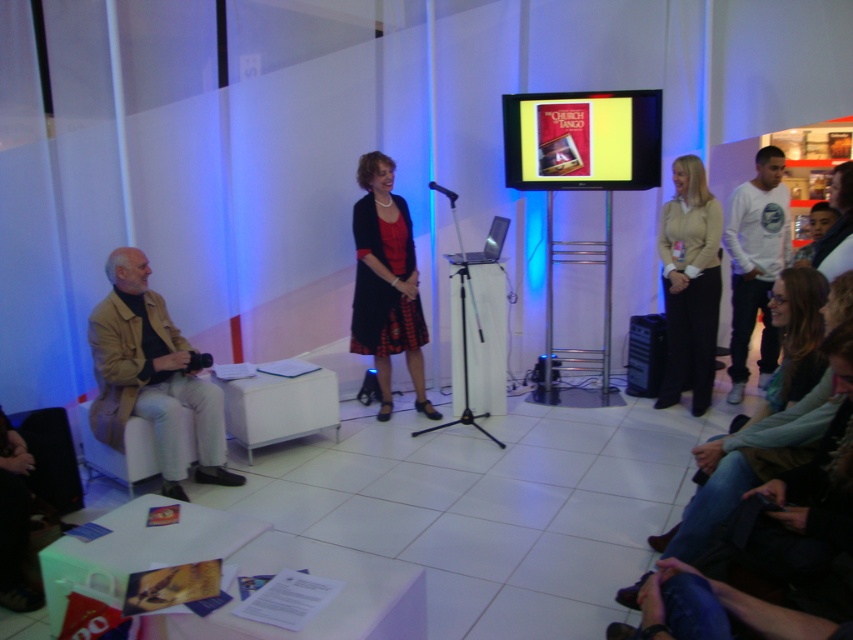
Question: Can you confirm if white cotton shirt at right is positioned above matte black jacket at lower left?

Choices:
 (A) yes
 (B) no

Answer: (A)

Question: Which of these objects is positioned closest to the beige fabric pants at right?

Choices:
 (A) matte black dress at center
 (B) beige fabric jacket at left

Answer: (A)

Question: Among these points, which one is nearest to the camera?

Choices:
 (A) (730, 268)
 (B) (676, 227)
 (C) (186, 371)
 (D) (376, 275)

Answer: (C)

Question: Which of these objects is positioned farthest from the matte black dress at center?

Choices:
 (A) beige fabric jacket at left
 (B) beige fabric pants at right
 (C) matte black jacket at lower left
 (D) white cotton shirt at right

Answer: (D)

Question: Can you confirm if matte black dress at center is positioned above matte black jacket at lower left?

Choices:
 (A) yes
 (B) no

Answer: (A)

Question: Is beige fabric pants at right below matte black jacket at lower left?

Choices:
 (A) no
 (B) yes

Answer: (A)